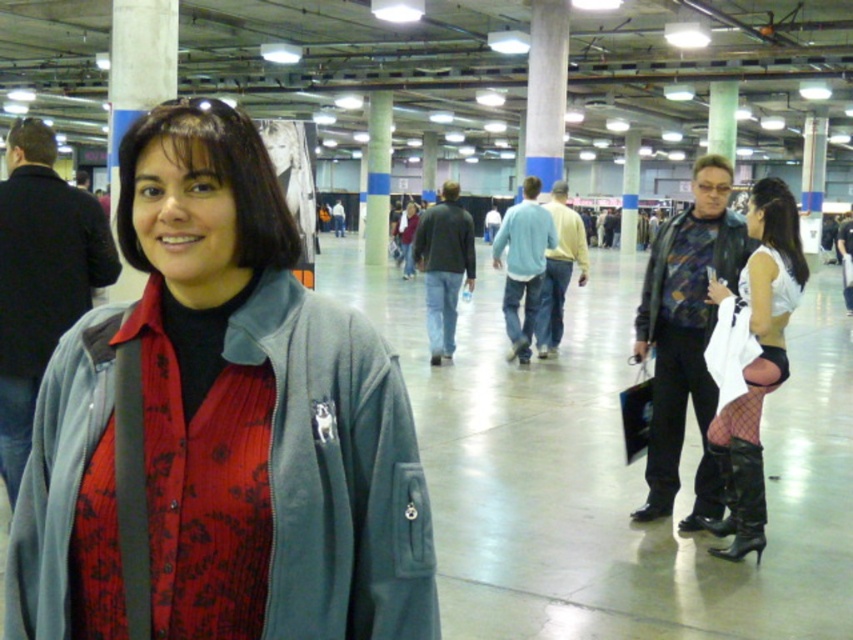
Where is the matte gray jacket at center located in the image?

The matte gray jacket at center is located at point 0.670 on the x axis and 0.257 on the y axis.

You are a photographer at the event and need to capture a closeup of both the white mesh stockings at right and the black leather boot at lower right. Which object should you zoom in more on to ensure they appear the same size in the photo?

The white mesh stockings at right has a larger size compared to the black leather boot at lower right, so you should zoom in more on the black leather boot at lower right to make them appear the same size in the photo.

You are a photographer at the event and want to capture a closeup of the white mesh stockings at right and the black leather boot at lower right. Which object should you zoom in on to ensure both are in frame without moving the camera?

The white mesh stockings at right is wider than the black leather boot at lower right, so you should zoom in on the white mesh stockings at right to ensure both fit in the frame.